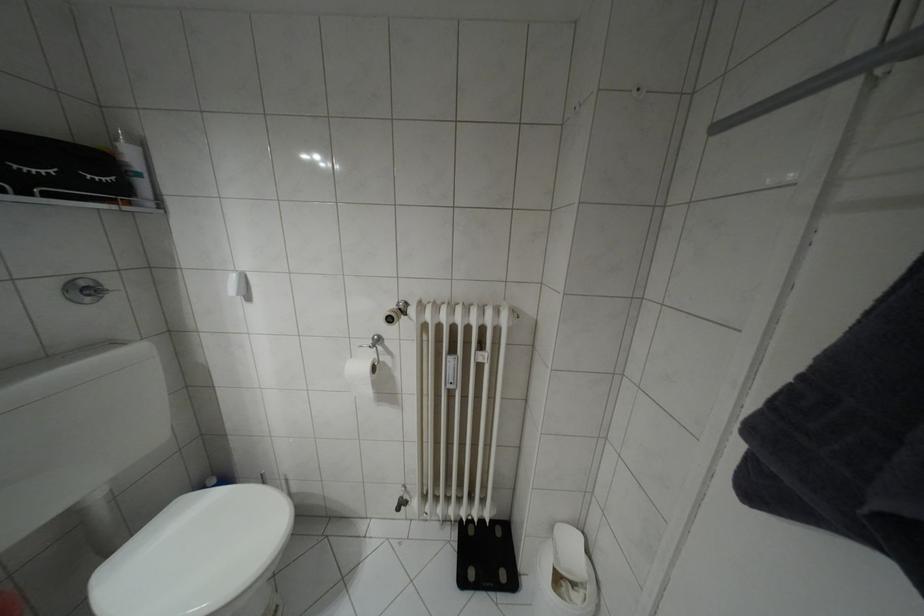
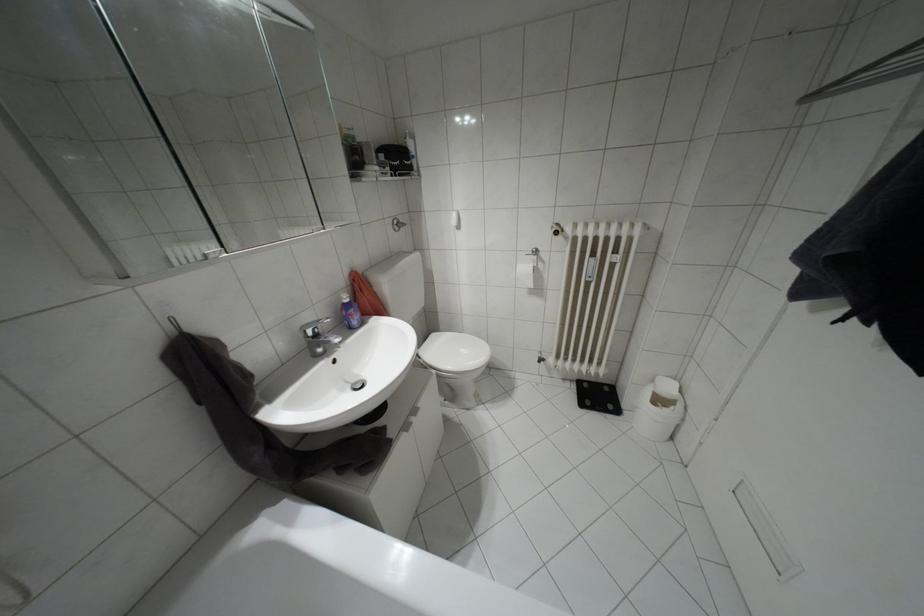
Question: The camera is either moving clockwise (left) or counter-clockwise (right) around the object. The first image is from the beginning of the video and the second image is from the end. Is the camera moving left or right when shooting the video?

Choices:
 (A) Left
 (B) Right

Answer: (B)